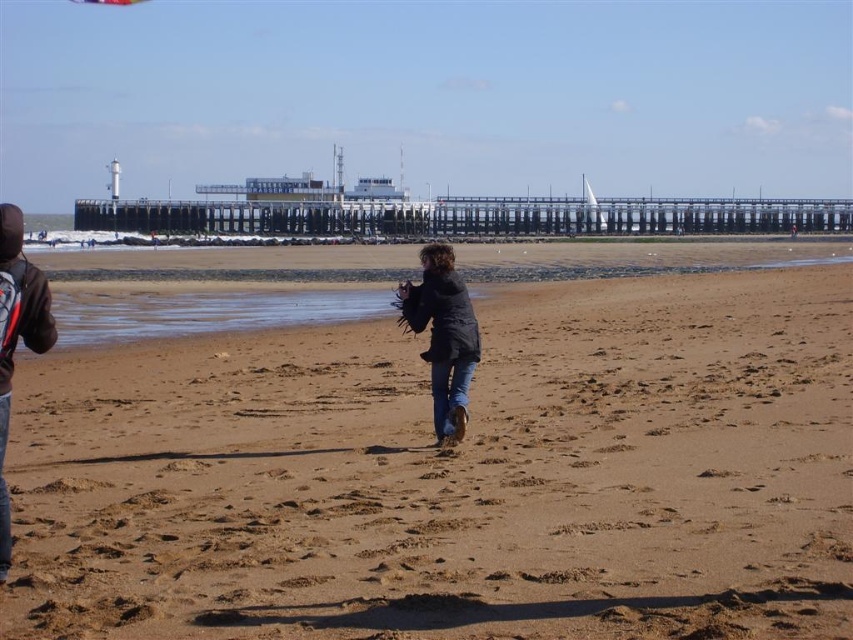
At what (x,y) coordinates should I click in order to perform the action: click on brown sandy beach at center. Please return your answer as a coordinate pair (x, y). Image resolution: width=853 pixels, height=640 pixels. Looking at the image, I should click on (454, 476).

Measure the distance from brown sandy beach at center to dark gray jacket at center.

A distance of 5.48 meters exists between brown sandy beach at center and dark gray jacket at center.

Image resolution: width=853 pixels, height=640 pixels. What do you see at coordinates (454, 476) in the screenshot? I see `brown sandy beach at center` at bounding box center [454, 476].

Locate an element on the screen. Image resolution: width=853 pixels, height=640 pixels. brown sandy beach at center is located at coordinates (454, 476).

Is brown sandy beach at center positioned in front of dark blue hoodie at left?

Yes.

Is point (161, 625) closer to viewer compared to point (22, 266)?

Yes, point (161, 625) is closer to viewer.

Which is in front, point (372, 552) or point (0, 220)?

Positioned in front is point (0, 220).

Where is `brown sandy beach at center`? Image resolution: width=853 pixels, height=640 pixels. brown sandy beach at center is located at coordinates 454,476.

Does dark gray jacket at center appear on the right side of dark blue hoodie at left?

Indeed, dark gray jacket at center is positioned on the right side of dark blue hoodie at left.

Is the position of dark gray jacket at center more distant than that of dark blue hoodie at left?

Yes.

Image resolution: width=853 pixels, height=640 pixels. What do you see at coordinates (444, 336) in the screenshot? I see `dark gray jacket at center` at bounding box center [444, 336].

At what (x,y) coordinates should I click in order to perform the action: click on dark gray jacket at center. Please return your answer as a coordinate pair (x, y). The height and width of the screenshot is (640, 853). Looking at the image, I should click on (444, 336).